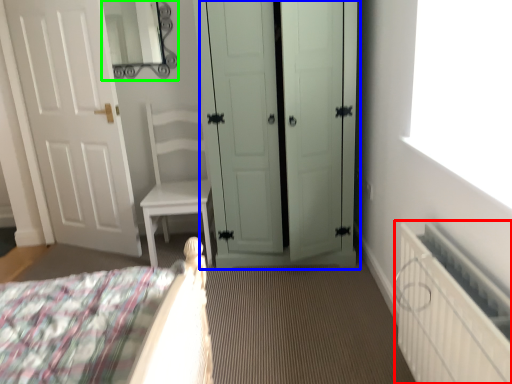
Question: Considering the real-world distances, which object is farthest from radiator (highlighted by a red box)? door (highlighted by a blue box) or mirror (highlighted by a green box)?

Choices:
 (A) door
 (B) mirror

Answer: (B)